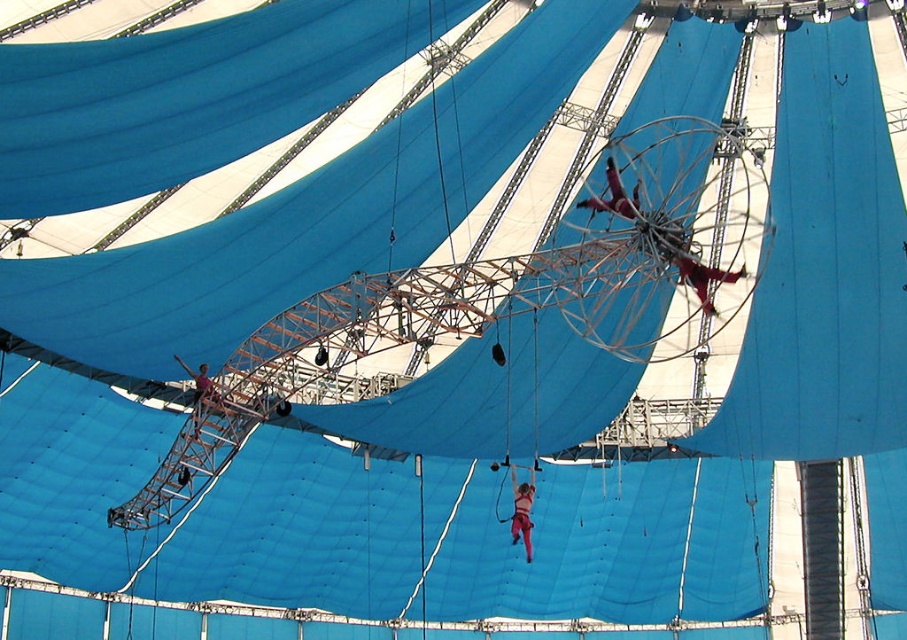
You are a safety inspector checking the distance between the metallic silver trapeze at upper center and the metallic red trapeze artist at center. According to safety regulations, the minimum safe distance between a performer and the trapeze must be at least 10 feet. Is the current distance compliant with the regulations?

The metallic silver trapeze at upper center is 11.06 feet away from the metallic red trapeze artist at center, which exceeds the minimum required 10 feet. Therefore, the current distance is compliant with the safety regulations.

You are a safety inspector checking the equipment in the tent. You notice the metallic silver trapeze at upper center and the matte pink harness at center. Which piece of equipment is bigger in size?

The metallic silver trapeze at upper center has a larger size compared to the matte pink harness at center, so the metallic silver trapeze at upper center is bigger.

You are an event planner assessing the safety of the performance area. Considering the metallic red trapeze artist at center and the matte pink harness at center, which object occupies more horizontal space in the scene?

The metallic red trapeze artist at center might be wider than the matte pink harness at center, so it likely occupies more horizontal space.